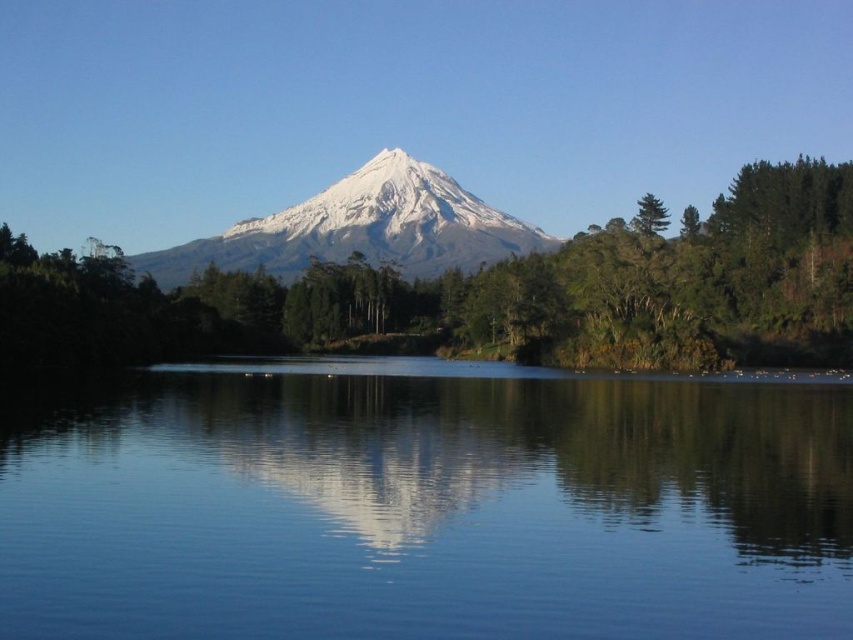
Looking at this image, you are standing at the edge of the smooth blue water at center. Looking towards the snow capped mountain in the background, which direction should you face to see the reflection of the mountain in the water?

You should face towards the snow capped mountain in the background to see its reflection in the smooth blue water at center because reflections are typically seen in the direction of the original object.

You are standing at the edge of the smooth blue water at center. Looking towards the mountain, where would you see the reflection of the snow? Is it on the water or in the sky?

The reflection of the snow would be on the smooth blue water at center because reflections typically appear on water surfaces, and the snow is on the mountain which is reflected in the water.